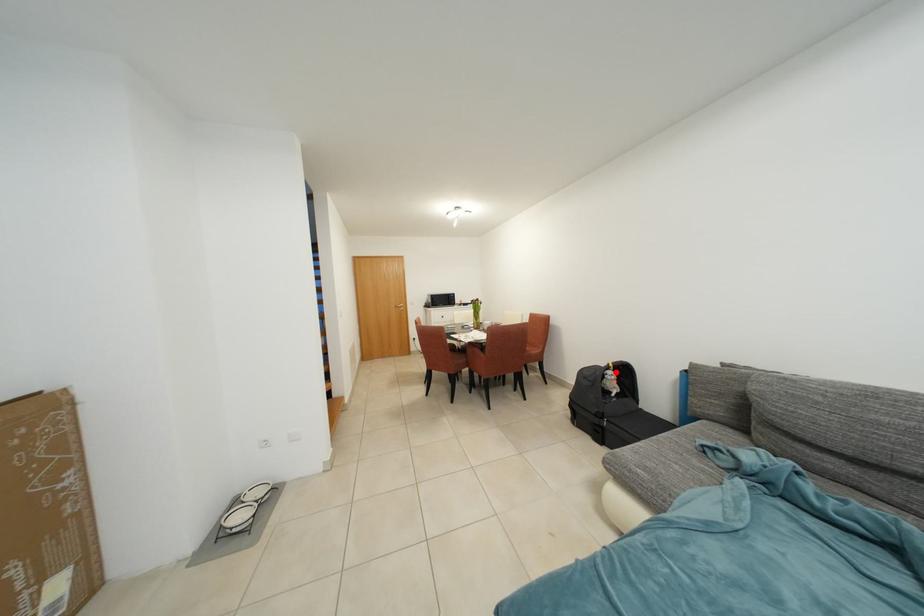
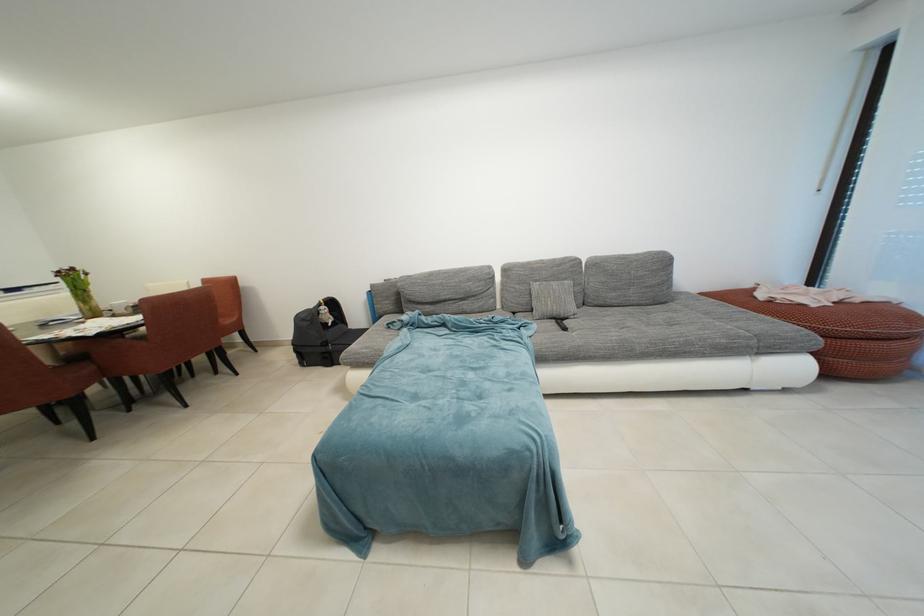
Where in the second image is the point corresponding to the highlighted location from the first image?

(329, 309)